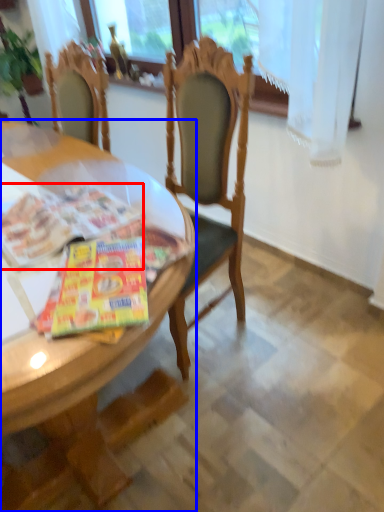
Question: Which object is further to the camera taking this photo, magazine (highlighted by a red box) or desk (highlighted by a blue box)?

Choices:
 (A) magazine
 (B) desk

Answer: (A)